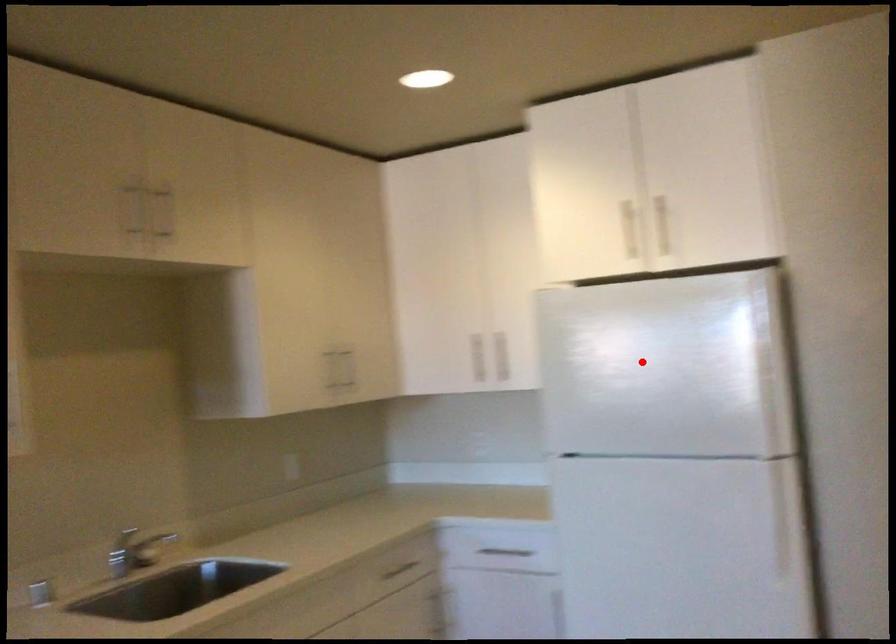
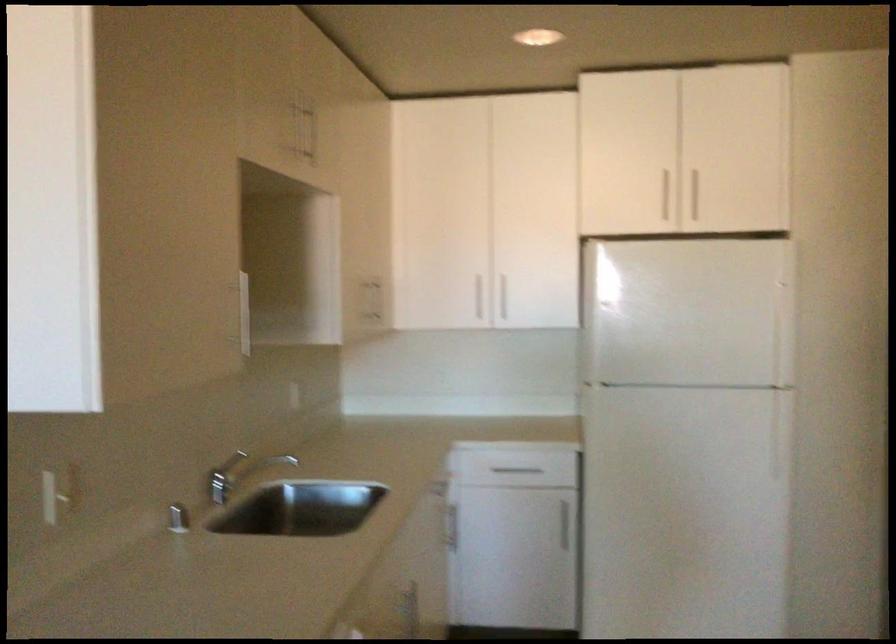
Where in the second image is the point corresponding to the highlighted location from the first image?

(687, 313)